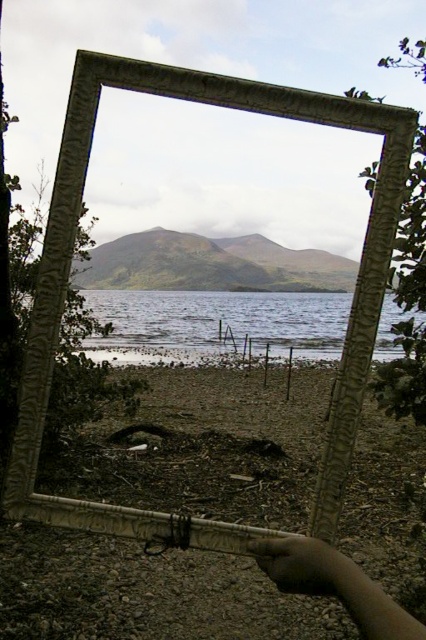
Is clear water at center below dark skin hand at lower right?

Actually, clear water at center is above dark skin hand at lower right.

Measure the distance between clear water at center and dark skin hand at lower right.

clear water at center is 9.99 meters away from dark skin hand at lower right.

You are a GUI agent. You are given a task and a screenshot of the screen. Output one action in this format:
    pyautogui.click(x=<x>, y=<y>)
    Task: Click on the clear water at center
    The image size is (426, 640).
    Given the screenshot: What is the action you would take?
    pyautogui.click(x=216, y=323)

Find the location of a particular element. The width and height of the screenshot is (426, 640). clear water at center is located at coordinates (216, 323).